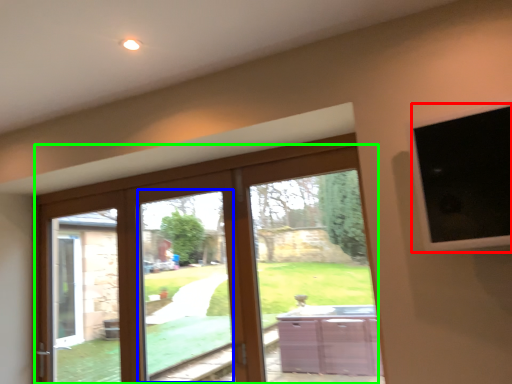
Question: Which object is the closest to the window screen (highlighted by a red box)? Choose among these: window (highlighted by a blue box) or door (highlighted by a green box).

Choices:
 (A) window
 (B) door

Answer: (B)